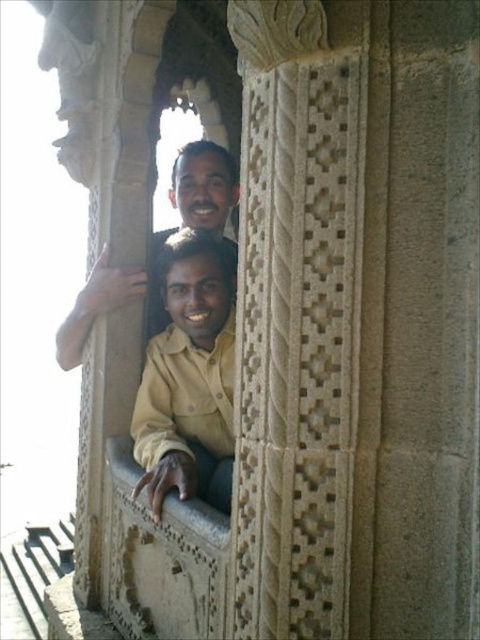
You are standing in the stone structure and want to take a photo of the matte beige shirt at center. Where should you aim your camera to capture it?

You should aim your camera at point (204, 186) to capture the matte beige shirt at center.